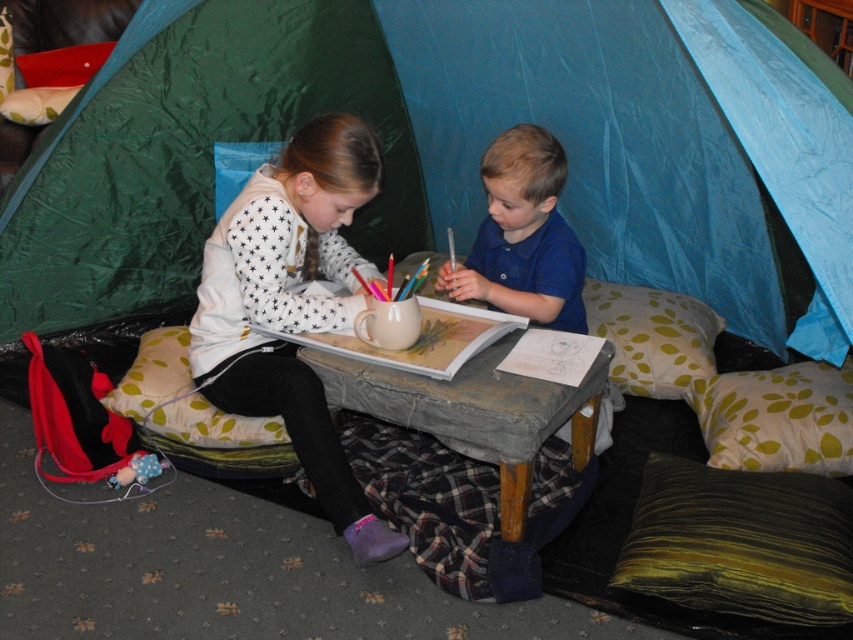
Question: Does velvety green pillow at lower right appear over fluffy beige pillow at upper left?

Choices:
 (A) no
 (B) yes

Answer: (A)

Question: Among these points, which one is farthest from the camera?

Choices:
 (A) (447, 106)
 (B) (831, 412)

Answer: (A)

Question: Does white dotted sweater at center appear on the right side of wooden tray at center?

Choices:
 (A) no
 (B) yes

Answer: (A)

Question: Which point appears farthest from the camera in this image?

Choices:
 (A) (492, 196)
 (B) (601, 307)

Answer: (B)

Question: Is green leaf-patterned pillow at right above fluffy beige pillow at upper left?

Choices:
 (A) yes
 (B) no

Answer: (B)

Question: Which of the following is the farthest from the observer?

Choices:
 (A) fluffy beige pillow at lower left
 (B) green fabric tent at center
 (C) white dotted sweater at center
 (D) velvety green pillow at lower right

Answer: (B)